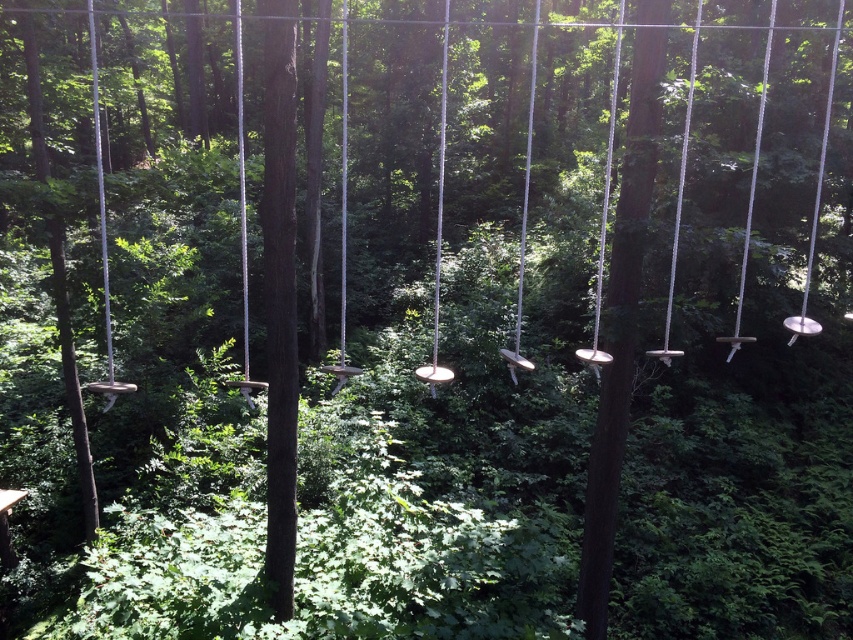
You are a park visitor standing in front of the swings. You want to sit on the metallic silver swing at left and the metallic silver swing at center. Which swing will you reach first if you walk straight towards them?

The metallic silver swing at left is in front of the metallic silver swing at center, so you will reach the metallic silver swing at left first.

From the picture: You are planning to hang a birdhouse between the metallic silver swing at left and the metallic silver swing at center. Since the birdhouse needs to be placed at the same height as the shorter swing, which swing should you use as a reference for the birdhouse height?

The metallic silver swing at left is shorter than the metallic silver swing at center, so you should use the metallic silver swing at left as the reference for the birdhouse height.

You are standing at the entrance of the forest and see two points in the scene labeled as point 1 at coordinates point (100, 176) and point 2 at coordinates point (421, 380). Which point is closer to you?

Point 1 at coordinates point (100, 176) is closer to you because it is in front of point 2 at coordinates point (421, 380).